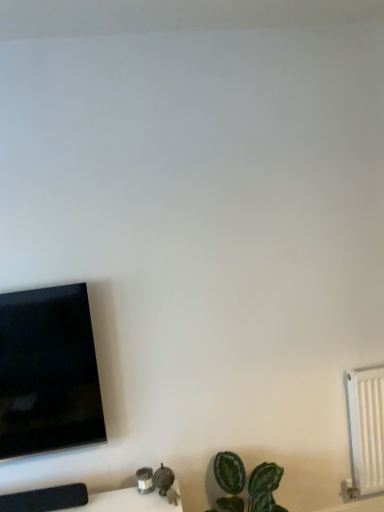
The width and height of the screenshot is (384, 512). Describe the element at coordinates (48, 372) in the screenshot. I see `black glossy tv at left` at that location.

I want to click on black glossy tv at left, so click(48, 372).

This screenshot has height=512, width=384. Describe the element at coordinates (366, 426) in the screenshot. I see `white plastic radiator at right` at that location.

You are a GUI agent. You are given a task and a screenshot of the screen. Output one action in this format:
    pyautogui.click(x=<x>, y=<y>)
    Task: Click on the white plastic radiator at right
    
    Given the screenshot: What is the action you would take?
    pyautogui.click(x=366, y=426)

Identify the location of black glossy tv at left. The height and width of the screenshot is (512, 384). (48, 372).

Based on their positions, is white plastic radiator at right located to the left or right of black glossy tv at left?

In the image, white plastic radiator at right appears on the right side of black glossy tv at left.

Is white plastic radiator at right behind black glossy tv at left?

Yes, white plastic radiator at right is further from the camera.

Considering the positions of point (372, 405) and point (47, 295), is point (372, 405) closer or farther from the camera than point (47, 295)?

Point (372, 405) appears to be farther away from the viewer than point (47, 295).

From the image's perspective, is white plastic radiator at right located beneath black glossy tv at left?

Yes.

From a real-world perspective, is white plastic radiator at right physically above black glossy tv at left?

No, from a real-world perspective, white plastic radiator at right is not on top of black glossy tv at left.

Based on the photo, which of these two, white plastic radiator at right or black glossy tv at left, is wider?

black glossy tv at left is wider.

Considering the sizes of objects white plastic radiator at right and black glossy tv at left in the image provided, who is shorter, white plastic radiator at right or black glossy tv at left?

With less height is white plastic radiator at right.

In the scene shown: Can you confirm if white plastic radiator at right is bigger than black glossy tv at left?

No.

Is white plastic radiator at right inside the boundaries of black glossy tv at left, or outside?

white plastic radiator at right is spatially situated outside black glossy tv at left.

Are white plastic radiator at right and black glossy tv at left making contact?

They are not placed beside each other.

Does white plastic radiator at right turn towards black glossy tv at left?

No, white plastic radiator at right does not turn towards black glossy tv at left.

How different are the orientations of white plastic radiator at right and black glossy tv at left in degrees?

The angle between the facing direction of white plastic radiator at right and the facing direction of black glossy tv at left is 0.487 degrees.

Where is `television in front of the white plastic radiator at right`? This screenshot has height=512, width=384. television in front of the white plastic radiator at right is located at coordinates (48, 372).

Which object is positioned more to the left, black glossy tv at left or white plastic radiator at right?

From the viewer's perspective, black glossy tv at left appears more on the left side.

Is black glossy tv at left closer to the viewer compared to white plastic radiator at right?

Yes, black glossy tv at left is in front of white plastic radiator at right.

Which point is more distant from viewer, (x=77, y=288) or (x=374, y=442)?

The point (x=374, y=442) is farther.

From the image's perspective, is black glossy tv at left located above or below white plastic radiator at right?

black glossy tv at left is above white plastic radiator at right.

From a real-world perspective, is black glossy tv at left above or below white plastic radiator at right?

Clearly, from a real-world perspective, black glossy tv at left is above white plastic radiator at right.

Between black glossy tv at left and white plastic radiator at right, which one has smaller width?

white plastic radiator at right.

Considering the sizes of objects black glossy tv at left and white plastic radiator at right in the image provided, who is taller, black glossy tv at left or white plastic radiator at right?

With more height is black glossy tv at left.

Looking at this image, in terms of size, does black glossy tv at left appear bigger or smaller than white plastic radiator at right?

In the image, black glossy tv at left appears to be larger than white plastic radiator at right.

Do you think black glossy tv at left is within white plastic radiator at right, or outside of it?

black glossy tv at left is not inside white plastic radiator at right, it's outside.

Is black glossy tv at left far from white plastic radiator at right?

black glossy tv at left is positioned a significant distance from white plastic radiator at right.

Is black glossy tv at left oriented towards white plastic radiator at right?

No, black glossy tv at left is not aimed at white plastic radiator at right.

How different are the orientations of black glossy tv at left and white plastic radiator at right in degrees?

They differ by 0.487 degrees in their facing directions.

Locate an element on the screen. This screenshot has height=512, width=384. television above the white plastic radiator at right (from a real-world perspective) is located at coordinates [48, 372].

Locate an element on the screen. This screenshot has width=384, height=512. radiator below the black glossy tv at left (from the image's perspective) is located at coordinates (366, 426).

The height and width of the screenshot is (512, 384). I want to click on radiator to the right of black glossy tv at left, so click(366, 426).